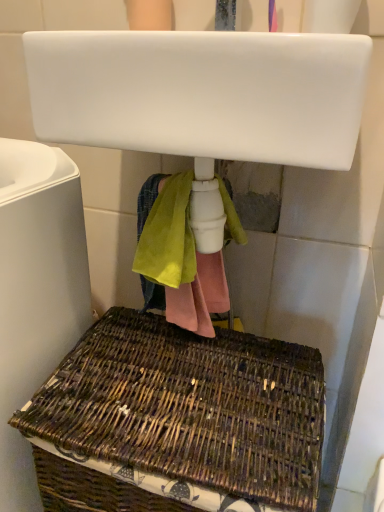
This screenshot has width=384, height=512. I want to click on free spot above brown woven picnic basket at lower center (from a real-world perspective), so click(186, 393).